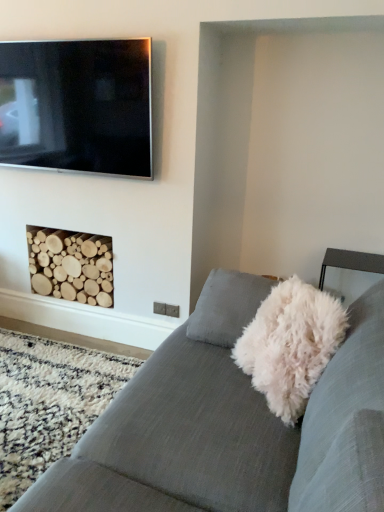
Question: Considering the positions of natural wood logs at lower left and flat screen tv at upper left in the image, is natural wood logs at lower left taller or shorter than flat screen tv at upper left?

Choices:
 (A) short
 (B) tall

Answer: (A)

Question: From the image's perspective, is natural wood logs at lower left positioned above or below flat screen tv at upper left?

Choices:
 (A) above
 (B) below

Answer: (B)

Question: Which object is positioned closest to the natural wood logs at lower left?

Choices:
 (A) textured gray couch at center
 (B) flat screen tv at upper left

Answer: (B)

Question: Which object is positioned farthest from the textured gray couch at center?

Choices:
 (A) natural wood logs at lower left
 (B) flat screen tv at upper left

Answer: (B)